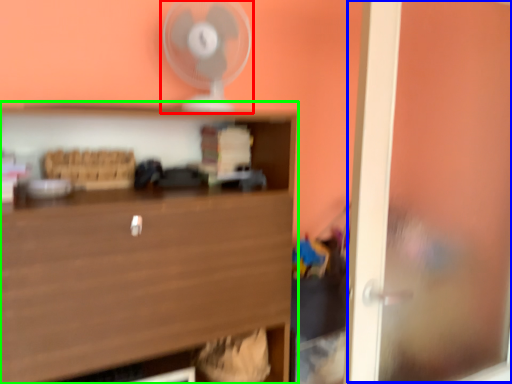
Question: Estimate the real-world distances between objects in this image. Which object is farther from fan (highlighted by a red box), window (highlighted by a blue box) or shelf (highlighted by a green box)?

Choices:
 (A) window
 (B) shelf

Answer: (A)